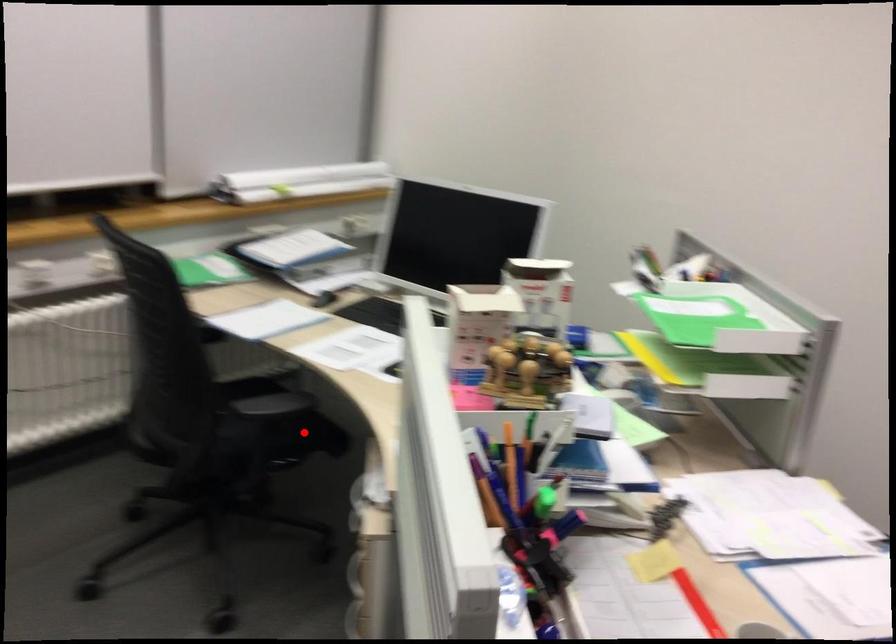
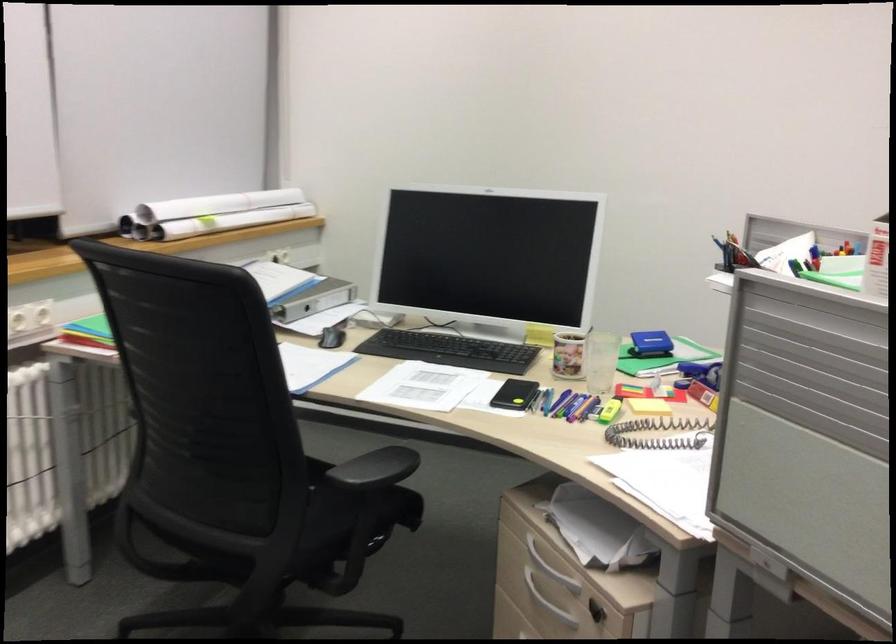
Question: I am providing you with two images of the same scene from different viewpoints. A red point is marked on the first image. Can you still see the location of the red point in image 2?

Choices:
 (A) Yes
 (B) No

Answer: (A)